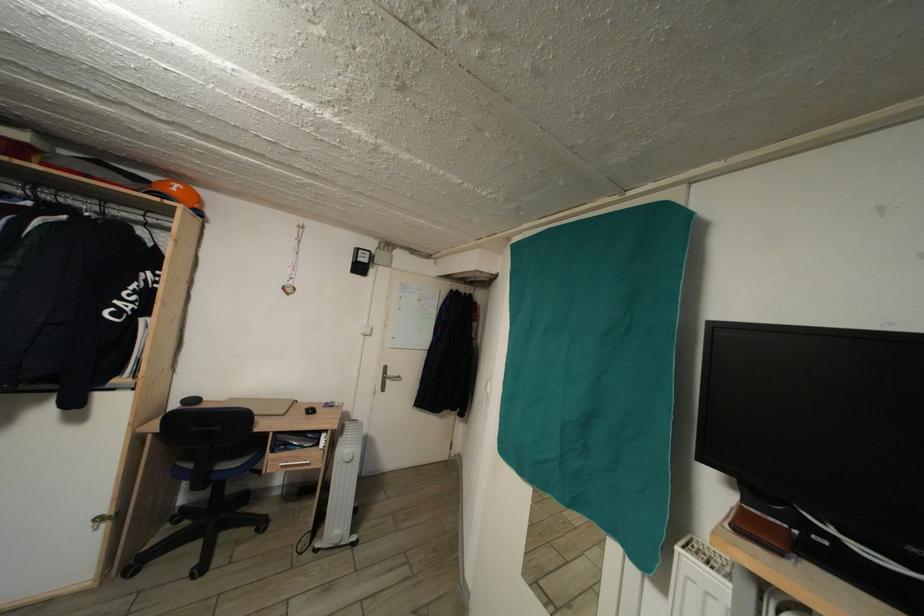
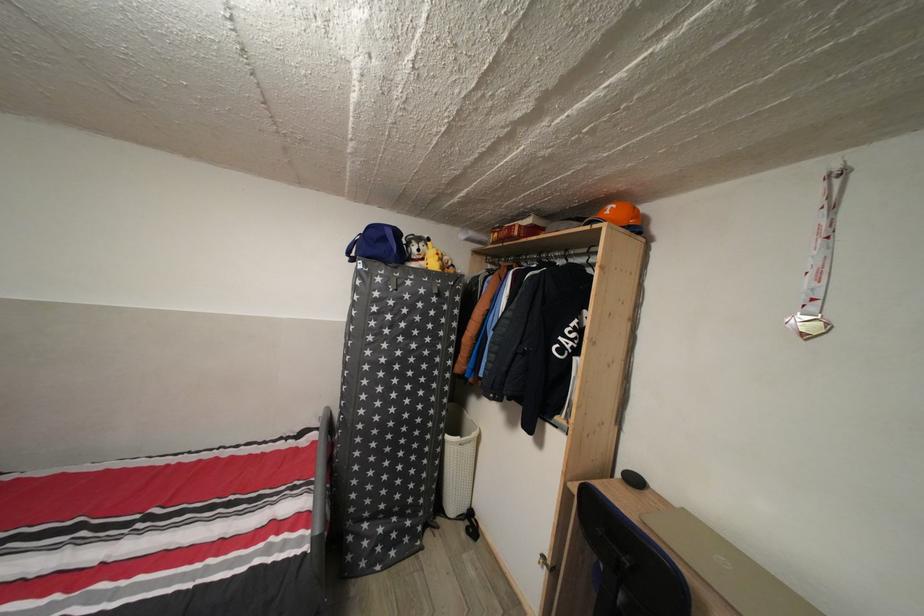
The point at (180, 196) is marked in the first image. Where is the corresponding point in the second image?

(614, 219)